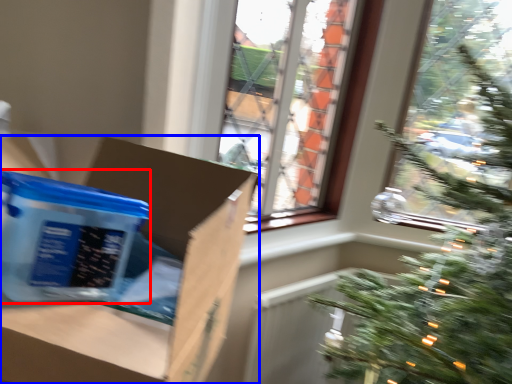
Question: Among these objects, which one is nearest to the camera, cardboard box (highlighted by a red box) or cardboard box (highlighted by a blue box)?

Choices:
 (A) cardboard box
 (B) cardboard box

Answer: (B)